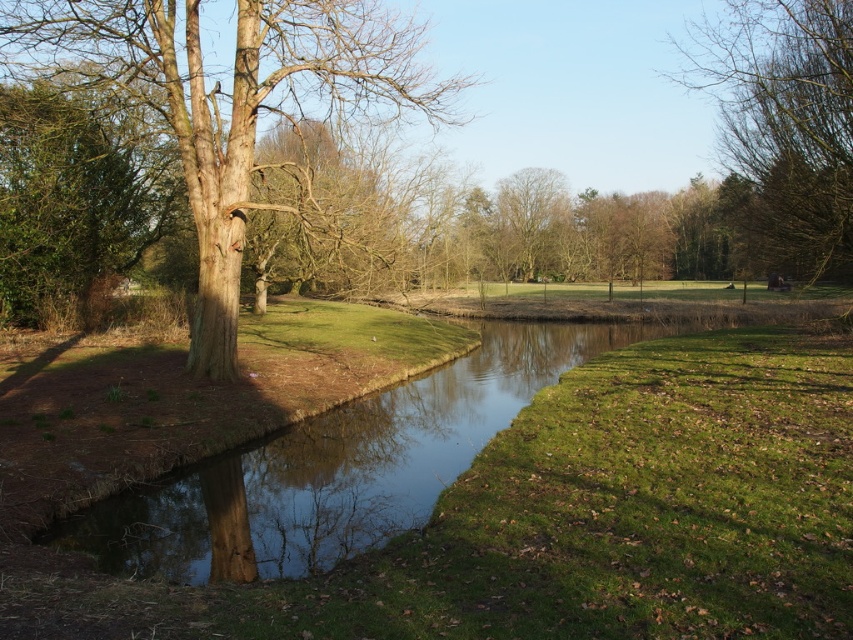
You are planning to hang a swing between the bare wood tree at upper right and the green leafy tree at left. Which tree should you choose as the anchor point if you want the swing to be closer to the stream?

The green leafy tree at left is closer to the stream, so you should choose it as the anchor point to position the swing near the stream.